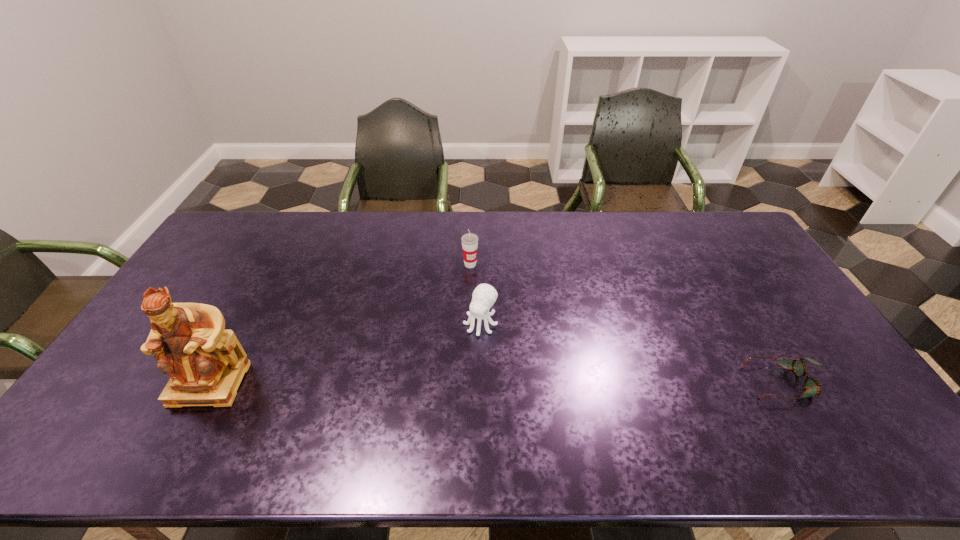
Locate an element on the screen. This screenshot has height=540, width=960. free space that is in between the farthest object and the figurine is located at coordinates (340, 324).

Where is `free space between the third tallest object and the leftmost object`? free space between the third tallest object and the leftmost object is located at coordinates (345, 353).

Locate an element on the screen. vacant area that lies between the second shortest object and the shortest object is located at coordinates (633, 353).

Identify the location of vacant point located between the rightmost object and the second farthest object. (633, 353).

What are the coordinates of `vacant space that is in between the shortest object and the second tallest object` in the screenshot? It's located at (628, 323).

What are the coordinates of `empty space that is in between the leftmost object and the rightmost object` in the screenshot? It's located at (497, 383).

At what (x,y) coordinates should I click in order to perform the action: click on object that ranks as the closest to the cup. Please return your answer as a coordinate pair (x, y). Image resolution: width=960 pixels, height=540 pixels. Looking at the image, I should click on (484, 296).

This screenshot has height=540, width=960. What are the coordinates of `object that is the nearest to the cup` in the screenshot? It's located at (484, 296).

I want to click on free space that satisfies the following two spatial constraints: 1. on the front side of the octopus; 2. on the front-facing side of the rightmost object, so click(x=480, y=383).

Find the location of a particular element. The width and height of the screenshot is (960, 540). free region that satisfies the following two spatial constraints: 1. on the front side of the shortest object; 2. on the front-facing side of the second farthest object is located at coordinates (480, 383).